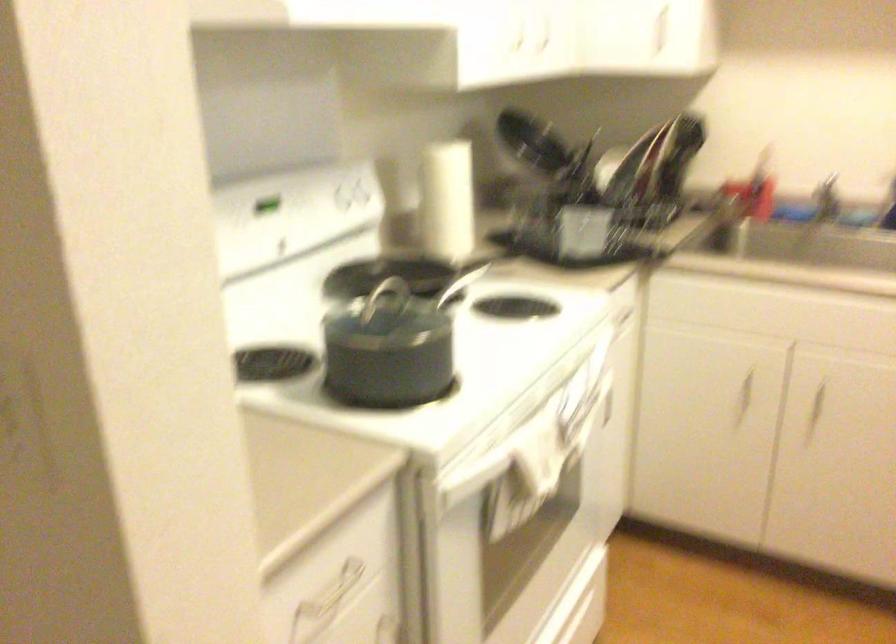
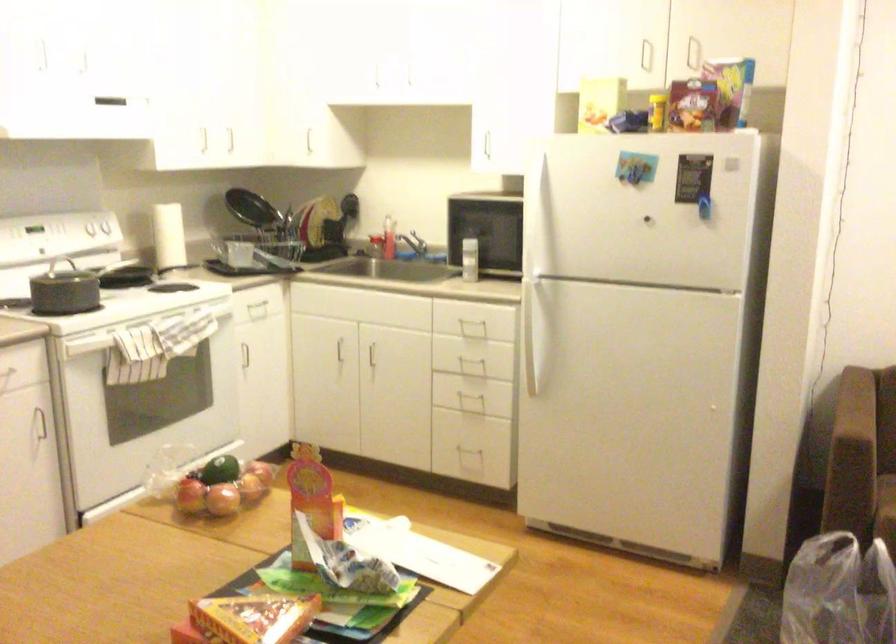
In the second image, find the point that corresponds to (x=554, y=504) in the first image.

(174, 382)